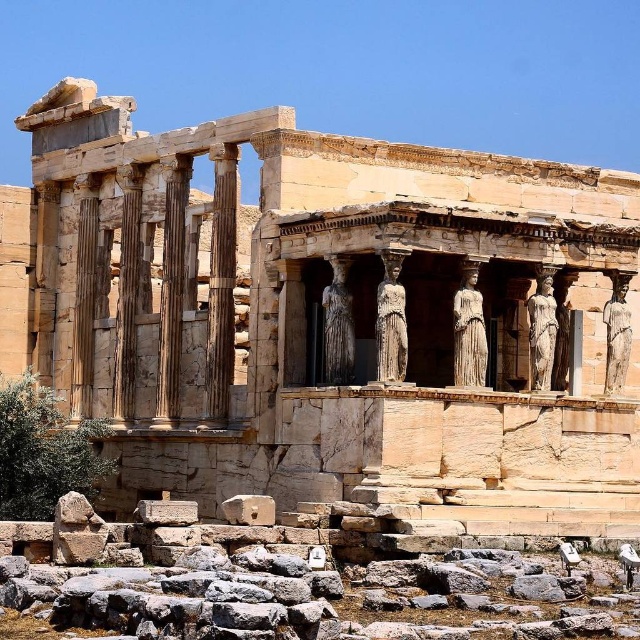
Based on the photo, is beige stone temple at center thinner than marble statue at center?

Incorrect, beige stone temple at center's width is not less than marble statue at center's.

From the picture: Does beige stone temple at center have a larger size compared to marble statue at center?

Indeed, beige stone temple at center has a larger size compared to marble statue at center.

Is point (428, 484) positioned in front of point (534, 301)?

Yes, it is in front of point (534, 301).

Locate an element on the screen. beige stone temple at center is located at coordinates (323, 316).

Is point (483, 316) more distant than point (531, 332)?

No, (483, 316) is in front of (531, 332).

Where is `polished stone statue at center`? polished stone statue at center is located at coordinates (468, 330).

Is beige stone temple at center further to the viewer compared to polished stone statue at center?

No, beige stone temple at center is closer to the viewer.

Does beige stone temple at center have a lesser width compared to polished stone statue at center?

In fact, beige stone temple at center might be wider than polished stone statue at center.

Is point (276, 304) more distant than point (461, 326)?

Yes, point (276, 304) is behind point (461, 326).

Image resolution: width=640 pixels, height=640 pixels. Identify the location of beige stone temple at center. (323, 316).